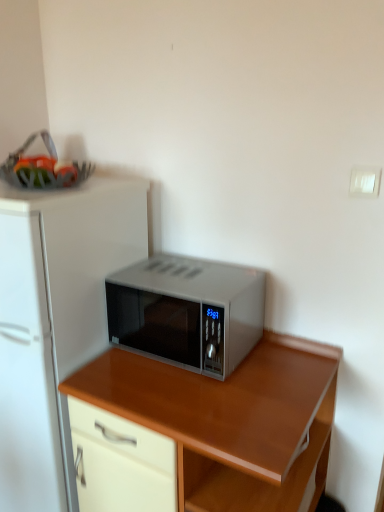
Identify the location of free space in front of satin silver microwave at center. The height and width of the screenshot is (512, 384). (203, 395).